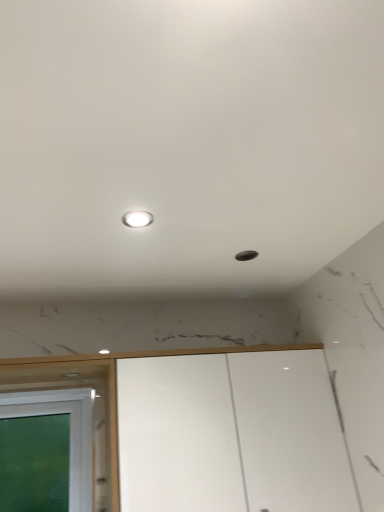
Question: Is white glossy cabinet at lower center outside of white glossy light at upper center?

Choices:
 (A) yes
 (B) no

Answer: (A)

Question: Is white glossy cabinet at lower center at the left side of white glossy light at upper center?

Choices:
 (A) yes
 (B) no

Answer: (B)

Question: Can you confirm if white glossy cabinet at lower center is thinner than white glossy light at upper center?

Choices:
 (A) no
 (B) yes

Answer: (A)

Question: Is white glossy cabinet at lower center positioned before white glossy light at upper center?

Choices:
 (A) yes
 (B) no

Answer: (B)

Question: Considering the relative sizes of white glossy cabinet at lower center and white glossy light at upper center in the image provided, is white glossy cabinet at lower center taller than white glossy light at upper center?

Choices:
 (A) yes
 (B) no

Answer: (A)

Question: In terms of width, does white glossy light at upper center look wider or thinner when compared to green glass window at lower left?

Choices:
 (A) wide
 (B) thin

Answer: (A)

Question: Visually, is white glossy light at upper center positioned to the left or to the right of green glass window at lower left?

Choices:
 (A) left
 (B) right

Answer: (B)

Question: From the image's perspective, is white glossy light at upper center positioned above or below green glass window at lower left?

Choices:
 (A) above
 (B) below

Answer: (A)

Question: From a real-world perspective, is white glossy light at upper center physically located above or below green glass window at lower left?

Choices:
 (A) above
 (B) below

Answer: (A)

Question: From a real-world perspective, is green glass window at lower left above or below white glossy cabinet at lower center?

Choices:
 (A) above
 (B) below

Answer: (A)

Question: From the image's perspective, is green glass window at lower left positioned above or below white glossy cabinet at lower center?

Choices:
 (A) below
 (B) above

Answer: (A)

Question: Considering the positions of green glass window at lower left and white glossy cabinet at lower center in the image, is green glass window at lower left bigger or smaller than white glossy cabinet at lower center?

Choices:
 (A) small
 (B) big

Answer: (A)

Question: Considering the positions of green glass window at lower left and white glossy cabinet at lower center in the image, is green glass window at lower left taller or shorter than white glossy cabinet at lower center?

Choices:
 (A) short
 (B) tall

Answer: (A)

Question: From a real-world perspective, is white glossy cabinet at lower center above or below green glass window at lower left?

Choices:
 (A) above
 (B) below

Answer: (B)

Question: Is point (276, 470) closer or farther from the camera than point (71, 457)?

Choices:
 (A) closer
 (B) farther

Answer: (A)